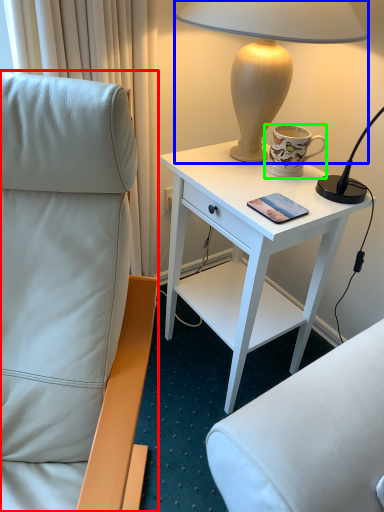
Question: Which is farther away from chair (highlighted by a red box)? lamp (highlighted by a blue box) or coffee cup (highlighted by a green box)?

Choices:
 (A) lamp
 (B) coffee cup

Answer: (B)